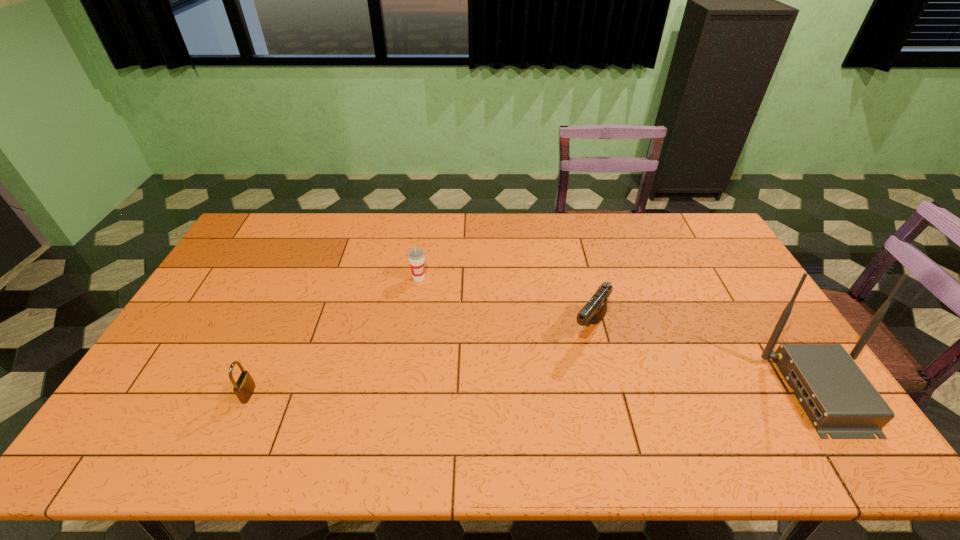
The width and height of the screenshot is (960, 540). What are the coordinates of `free space located 0.220m at the barrel of the third nearest object` in the screenshot? It's located at (540, 398).

What are the coordinates of `vacant space located on the side of the third object from right to left with the logo` in the screenshot? It's located at (446, 318).

The image size is (960, 540). In order to click on vacant position located on the side of the third object from right to left with the logo in this screenshot , I will do `click(459, 335)`.

Identify the location of vacant space situated 0.210m on the side of the third object from right to left with the logo. This screenshot has width=960, height=540. point(451,325).

Image resolution: width=960 pixels, height=540 pixels. I want to click on padlock that is at the near edge, so click(244, 387).

Where is `router at the near edge`? The image size is (960, 540). router at the near edge is located at coordinates coord(839,399).

At what (x,y) coordinates should I click in order to perform the action: click on object at the right edge. Please return your answer as a coordinate pair (x, y). This screenshot has height=540, width=960. Looking at the image, I should click on (839, 399).

Where is `object situated at the near right corner`? object situated at the near right corner is located at coordinates (839, 399).

Find the location of a particular element. vacant space at the far edge of the desktop is located at coordinates (584, 248).

Locate an element on the screen. vacant position at the near edge of the desktop is located at coordinates (543, 393).